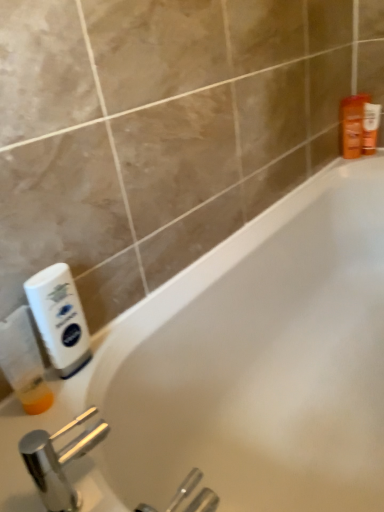
The height and width of the screenshot is (512, 384). What do you see at coordinates (59, 460) in the screenshot? I see `polished chrome faucet at lower left` at bounding box center [59, 460].

Locate an element on the screen. This screenshot has width=384, height=512. white plastic bottle at left, acting as the 2th cleaning product starting from the left is located at coordinates (59, 318).

What are the coordinates of `orange matte lotion at upper right, marked as the 1th toiletry in a right-to-left arrangement` in the screenshot? It's located at (370, 127).

Describe the element at coordinates (24, 362) in the screenshot. I see `translucent plastic bottle at left, positioned as the second cleaning product in right-to-left order` at that location.

The width and height of the screenshot is (384, 512). What do you see at coordinates (352, 124) in the screenshot?
I see `orange plastic bottle at upper right, which appears as the 2th toiletry when viewed from the right` at bounding box center [352, 124].

You are a GUI agent. You are given a task and a screenshot of the screen. Output one action in this format:
    pyautogui.click(x=<x>, y=<y>)
    Task: Click on the polished chrome faucet at lower left
    This screenshot has height=512, width=384.
    Given the screenshot: What is the action you would take?
    pyautogui.click(x=59, y=460)

Who is smaller, white glossy bathtub at center or orange plastic bottle at upper right, the 1th toiletry viewed from the left?

With smaller size is orange plastic bottle at upper right, the 1th toiletry viewed from the left.

Is white glossy bathtub at center aimed at orange plastic bottle at upper right, which appears as the 2th toiletry when viewed from the right?

No, white glossy bathtub at center is not turned towards orange plastic bottle at upper right, which appears as the 2th toiletry when viewed from the right.

From the image's perspective, which one is positioned higher, white glossy bathtub at center or orange plastic bottle at upper right, the 1th toiletry viewed from the left?

orange plastic bottle at upper right, the 1th toiletry viewed from the left, is shown above in the image.

From a real-world perspective, does white glossy bathtub at center sit lower than orange plastic bottle at upper right, which appears as the 2th toiletry when viewed from the right?

Indeed, from a real-world perspective, white glossy bathtub at center is positioned beneath orange plastic bottle at upper right, which appears as the 2th toiletry when viewed from the right.

From a real-world perspective, which is physically below, white glossy bathtub at center or polished chrome faucet at lower left?

white glossy bathtub at center.

Consider the image. Considering the relative sizes of white glossy bathtub at center and polished chrome faucet at lower left in the image provided, is white glossy bathtub at center bigger than polished chrome faucet at lower left?

Indeed, white glossy bathtub at center has a larger size compared to polished chrome faucet at lower left.

Consider the image. Is white glossy bathtub at center inside the boundaries of polished chrome faucet at lower left, or outside?

The correct answer is: outside.

From the image's perspective, which is above, white glossy bathtub at center or polished chrome faucet at lower left?

white glossy bathtub at center, from the image's perspective.

From the image's perspective, is orange matte lotion at upper right, marked as the 1th toiletry in a right-to-left arrangement, under white glossy bathtub at center?

No, from the image's perspective, orange matte lotion at upper right, marked as the 1th toiletry in a right-to-left arrangement, is not below white glossy bathtub at center.

Considering the relative positions of orange matte lotion at upper right, marked as the 1th toiletry in a right-to-left arrangement, and white glossy bathtub at center in the image provided, is orange matte lotion at upper right, marked as the 1th toiletry in a right-to-left arrangement, to the left of white glossy bathtub at center from the viewer's perspective?

No, orange matte lotion at upper right, marked as the 1th toiletry in a right-to-left arrangement, is not to the left of white glossy bathtub at center.

Which of these two, orange matte lotion at upper right, the second toiletry positioned from the left, or white glossy bathtub at center, stands shorter?

orange matte lotion at upper right, the second toiletry positioned from the left.

Is polished chrome faucet at lower left inside the boundaries of white plastic bottle at left, acting as the 2th cleaning product starting from the left, or outside?

polished chrome faucet at lower left is spatially situated outside white plastic bottle at left, acting as the 2th cleaning product starting from the left.

From a real-world perspective, is polished chrome faucet at lower left positioned over white plastic bottle at left, acting as the 2th cleaning product starting from the left, based on gravity?

Incorrect, from a real-world perspective, polished chrome faucet at lower left is lower than white plastic bottle at left, acting as the 2th cleaning product starting from the left.

Does polished chrome faucet at lower left appear on the right side of white plastic bottle at left, acting as the 2th cleaning product starting from the left?

Yes, polished chrome faucet at lower left is to the right of white plastic bottle at left, acting as the 2th cleaning product starting from the left.

Where is `tap that appears below the orange plastic bottle at upper right, the 1th toiletry viewed from the left (from a real-world perspective)`? The width and height of the screenshot is (384, 512). tap that appears below the orange plastic bottle at upper right, the 1th toiletry viewed from the left (from a real-world perspective) is located at coordinates (59, 460).

Looking at their sizes, would you say polished chrome faucet at lower left is wider or thinner than orange plastic bottle at upper right, the 1th toiletry viewed from the left?

Considering their sizes, polished chrome faucet at lower left looks broader than orange plastic bottle at upper right, the 1th toiletry viewed from the left.

Is polished chrome faucet at lower left oriented towards orange plastic bottle at upper right, which appears as the 2th toiletry when viewed from the right?

Yes.

Measure the distance between polished chrome faucet at lower left and orange plastic bottle at upper right, the 1th toiletry viewed from the left.

polished chrome faucet at lower left is 1.39 meters from orange plastic bottle at upper right, the 1th toiletry viewed from the left.

Does white plastic bottle at left, the 1th cleaning product in the right-to-left sequence, have a lesser width compared to white glossy bathtub at center?

Yes.

Considering the relative positions of white plastic bottle at left, the 1th cleaning product in the right-to-left sequence, and white glossy bathtub at center in the image provided, is white plastic bottle at left, the 1th cleaning product in the right-to-left sequence, to the left or to the right of white glossy bathtub at center?

In the image, white plastic bottle at left, the 1th cleaning product in the right-to-left sequence, appears on the left side of white glossy bathtub at center.

Is point (59, 310) positioned before point (369, 318)?

That is True.

How distant is white plastic bottle at left, acting as the 2th cleaning product starting from the left, from white glossy bathtub at center?

white plastic bottle at left, acting as the 2th cleaning product starting from the left, is 41.65 centimeters from white glossy bathtub at center.

From the image's perspective, is polished chrome faucet at lower left below white glossy bathtub at center?

Indeed, from the image's perspective, polished chrome faucet at lower left is shown beneath white glossy bathtub at center.

Is polished chrome faucet at lower left far away from white glossy bathtub at center?

That's not correct — polished chrome faucet at lower left is a little close to white glossy bathtub at center.

I want to click on bathtub above the polished chrome faucet at lower left (from the image's perspective), so click(x=242, y=368).

Which object is more forward, polished chrome faucet at lower left or white glossy bathtub at center?

white glossy bathtub at center is in front.

From the image's perspective, starting from the white glossy bathtub at center, which toiletry is the 2nd one above? Please provide its 2D coordinates.

[(352, 124)]

Locate an element on the screen. Image resolution: width=384 pixels, height=512 pixels. tap located behind the white glossy bathtub at center is located at coordinates (59, 460).

Which object lies nearer to the anchor point orange matte lotion at upper right, marked as the 1th toiletry in a right-to-left arrangement, polished chrome faucet at lower left or white glossy bathtub at center?

The object closer to orange matte lotion at upper right, marked as the 1th toiletry in a right-to-left arrangement, is white glossy bathtub at center.

Which object lies nearer to the anchor point orange plastic bottle at upper right, the 1th toiletry viewed from the left, white plastic bottle at left, acting as the 2th cleaning product starting from the left, or translucent plastic bottle at left, positioned as the second cleaning product in right-to-left order?

white plastic bottle at left, acting as the 2th cleaning product starting from the left.

Estimate the real-world distances between objects in this image. Which object is closer to orange plastic bottle at upper right, the 1th toiletry viewed from the left, white glossy bathtub at center or white plastic bottle at left, acting as the 2th cleaning product starting from the left?

white glossy bathtub at center lies closer to orange plastic bottle at upper right, the 1th toiletry viewed from the left, than the other object.

When comparing their distances from white plastic bottle at left, acting as the 2th cleaning product starting from the left, does orange matte lotion at upper right, the second toiletry positioned from the left, or white glossy bathtub at center seem further?

orange matte lotion at upper right, the second toiletry positioned from the left.

From the image, which object appears to be farther from orange matte lotion at upper right, marked as the 1th toiletry in a right-to-left arrangement, translucent plastic bottle at left, positioned as the second cleaning product in right-to-left order, or white plastic bottle at left, acting as the 2th cleaning product starting from the left?

The object further to orange matte lotion at upper right, marked as the 1th toiletry in a right-to-left arrangement, is translucent plastic bottle at left, positioned as the second cleaning product in right-to-left order.

Looking at the image, which one is located closer to polished chrome faucet at lower left, orange plastic bottle at upper right, the 1th toiletry viewed from the left, or white plastic bottle at left, acting as the 2th cleaning product starting from the left?

white plastic bottle at left, acting as the 2th cleaning product starting from the left, is positioned closer to the anchor polished chrome faucet at lower left.

When comparing their distances from orange plastic bottle at upper right, the 1th toiletry viewed from the left, does white plastic bottle at left, acting as the 2th cleaning product starting from the left, or polished chrome faucet at lower left seem further?

polished chrome faucet at lower left is positioned further to the anchor orange plastic bottle at upper right, the 1th toiletry viewed from the left.

In the scene shown: From the image, which object appears to be farther from orange matte lotion at upper right, marked as the 1th toiletry in a right-to-left arrangement, white glossy bathtub at center or white plastic bottle at left, acting as the 2th cleaning product starting from the left?

white plastic bottle at left, acting as the 2th cleaning product starting from the left, is further to orange matte lotion at upper right, marked as the 1th toiletry in a right-to-left arrangement.

You are a GUI agent. You are given a task and a screenshot of the screen. Output one action in this format:
    pyautogui.click(x=<x>, y=<y>)
    Task: Click on the cleaning product between translucent plastic bottle at left, positioned as the second cleaning product in right-to-left order, and white glossy bathtub at center
    
    Given the screenshot: What is the action you would take?
    pyautogui.click(x=59, y=318)

This screenshot has width=384, height=512. In order to click on tap situated between white plastic bottle at left, acting as the 2th cleaning product starting from the left, and white glossy bathtub at center from left to right in this screenshot , I will do `click(59, 460)`.

Locate an element on the screen. The image size is (384, 512). toiletry located between polished chrome faucet at lower left and orange matte lotion at upper right, the second toiletry positioned from the left, in the depth direction is located at coordinates (352, 124).

Locate an element on the screen. This screenshot has width=384, height=512. toiletry between white plastic bottle at left, acting as the 2th cleaning product starting from the left, and orange matte lotion at upper right, marked as the 1th toiletry in a right-to-left arrangement, from front to back is located at coordinates (352, 124).